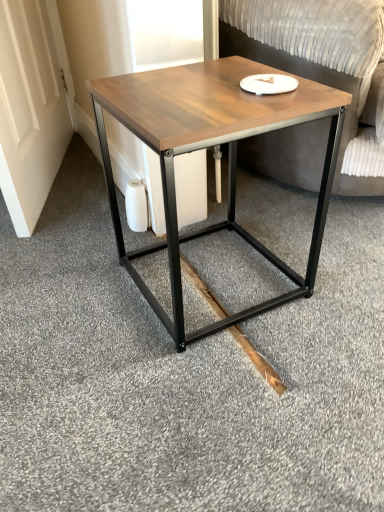
This screenshot has height=512, width=384. What are the coordinates of `vacant region above wooden matte coffee table at center (from a real-world perspective)` in the screenshot? It's located at (185, 92).